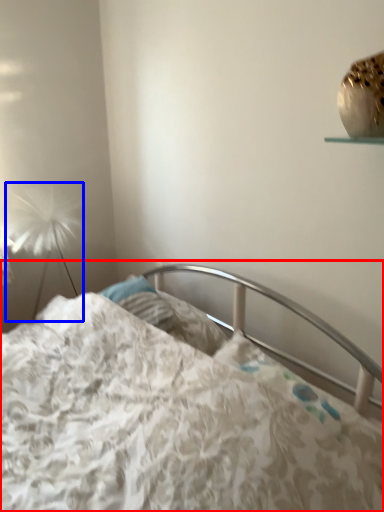
Question: Which object appears closest to the camera in this image, bed (highlighted by a red box) or lamp (highlighted by a blue box)?

Choices:
 (A) bed
 (B) lamp

Answer: (A)